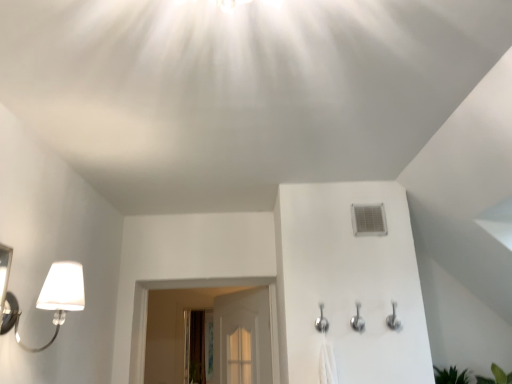
Question: Considering the relative sizes of silver metallic shower head at center and white matte lamp at left in the image provided, is silver metallic shower head at center bigger than white matte lamp at left?

Choices:
 (A) yes
 (B) no

Answer: (B)

Question: Are silver metallic shower head at center and white matte lamp at left located far from each other?

Choices:
 (A) yes
 (B) no

Answer: (A)

Question: Considering the relative sizes of silver metallic shower head at center and white matte lamp at left in the image provided, is silver metallic shower head at center wider than white matte lamp at left?

Choices:
 (A) no
 (B) yes

Answer: (A)

Question: Is silver metallic shower head at center outside of white matte lamp at left?

Choices:
 (A) no
 (B) yes

Answer: (B)

Question: Considering the relative sizes of silver metallic shower head at center and white matte lamp at left in the image provided, is silver metallic shower head at center thinner than white matte lamp at left?

Choices:
 (A) yes
 (B) no

Answer: (A)

Question: Choose the correct answer: Is white plastic air conditioner at upper right inside white matte lamp at left or outside it?

Choices:
 (A) inside
 (B) outside

Answer: (B)

Question: From a real-world perspective, relative to white matte lamp at left, is white plastic air conditioner at upper right vertically above or below?

Choices:
 (A) below
 (B) above

Answer: (B)

Question: Considering the positions of point (359, 228) and point (37, 302), is point (359, 228) closer or farther from the camera than point (37, 302)?

Choices:
 (A) closer
 (B) farther

Answer: (B)

Question: Is white plastic air conditioner at upper right taller or shorter than white matte lamp at left?

Choices:
 (A) tall
 (B) short

Answer: (B)

Question: In the image, is silver metallic shower head at center positioned in front of or behind clear glass screen door at center?

Choices:
 (A) behind
 (B) front

Answer: (B)

Question: Considering the positions of point [325, 321] and point [197, 345], is point [325, 321] closer or farther from the camera than point [197, 345]?

Choices:
 (A) closer
 (B) farther

Answer: (A)

Question: From a real-world perspective, is silver metallic shower head at center positioned above or below clear glass screen door at center?

Choices:
 (A) below
 (B) above

Answer: (B)

Question: From the image's perspective, is silver metallic shower head at center located above or below clear glass screen door at center?

Choices:
 (A) above
 (B) below

Answer: (A)

Question: From the image's perspective, relative to silver metallic shower head at center, is white plastic air conditioner at upper right above or below?

Choices:
 (A) below
 (B) above

Answer: (B)

Question: In terms of width, does white plastic air conditioner at upper right look wider or thinner when compared to silver metallic shower head at center?

Choices:
 (A) thin
 (B) wide

Answer: (A)